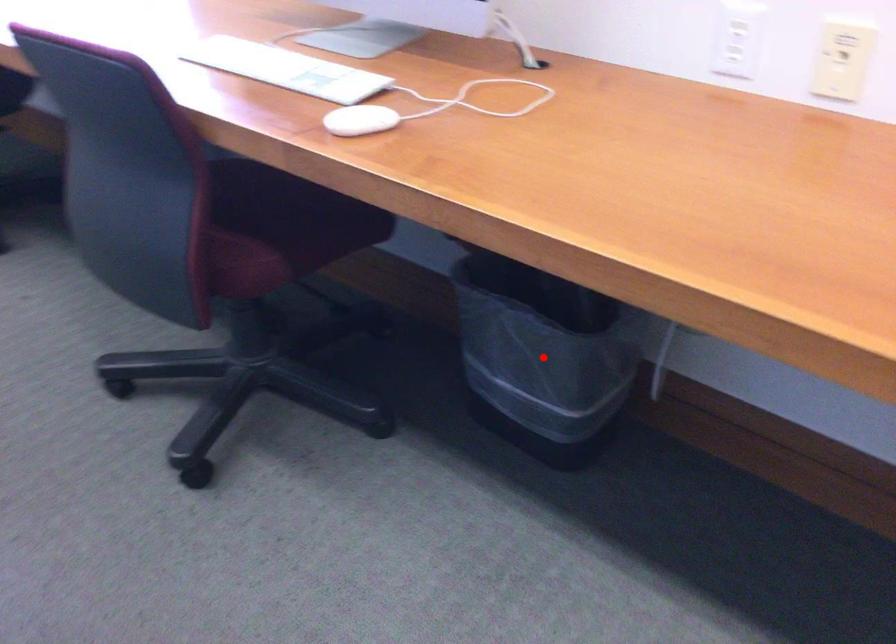
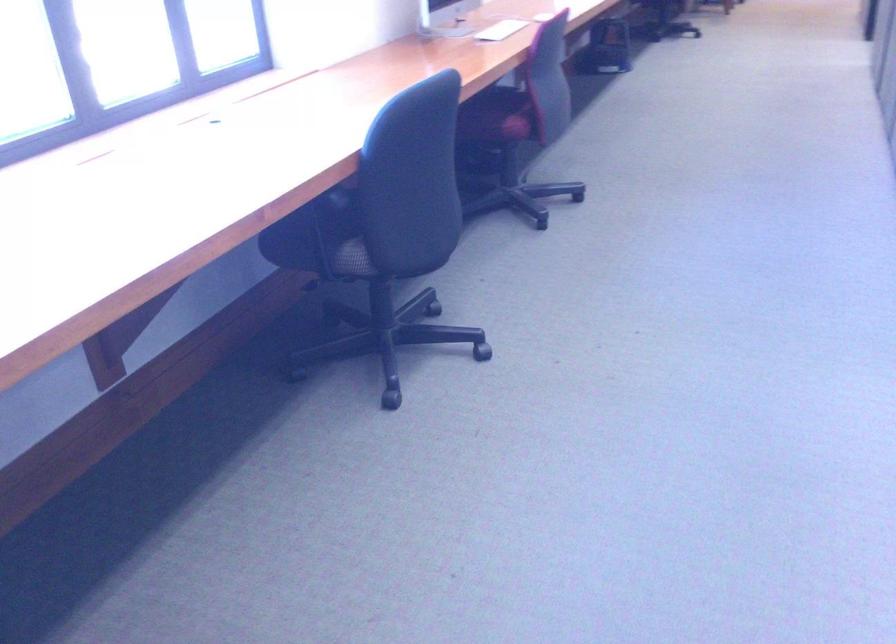
Question: I am providing you with two images of the same scene from different viewpoints. A red point is marked on the first image. Is the red point's position out of view in image 2?

Choices:
 (A) Yes
 (B) No

Answer: (A)